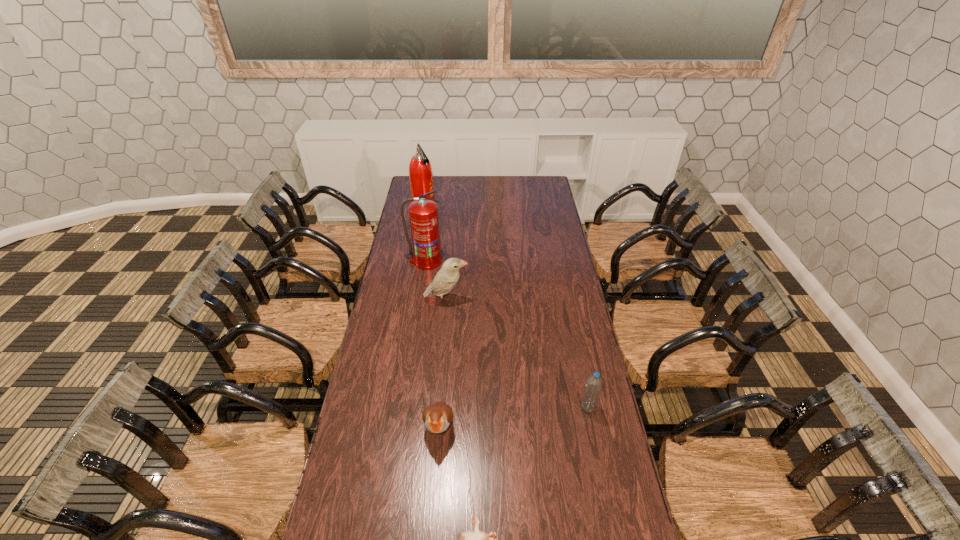
Where is `free spot located 0.050m on the front of the fourth tallest object`? The height and width of the screenshot is (540, 960). free spot located 0.050m on the front of the fourth tallest object is located at coordinates (592, 427).

At what (x,y) coordinates should I click in order to perform the action: click on vacant space located 0.090m at the face of the second farthest bird. Please return your answer as a coordinate pair (x, y). Looking at the image, I should click on (x=435, y=479).

Identify the location of object situated at the right edge. click(x=592, y=390).

At what (x,y) coordinates should I click in order to perform the action: click on vacant space at the far edge of the desktop. Please return your answer as a coordinate pair (x, y). The height and width of the screenshot is (540, 960). Looking at the image, I should click on (463, 178).

Find the location of a particular element. The width and height of the screenshot is (960, 540). blank space at the left edge is located at coordinates (350, 463).

This screenshot has width=960, height=540. I want to click on vacant area at the right edge of the desktop, so click(x=550, y=227).

What are the coordinates of `free space at the far right corner of the desktop` in the screenshot? It's located at (534, 178).

Image resolution: width=960 pixels, height=540 pixels. I want to click on free space between the second farthest object and the water bottle, so click(x=507, y=334).

What are the coordinates of `vacant area that lies between the farthest object and the rightmost object` in the screenshot? It's located at (506, 311).

You are a GUI agent. You are given a task and a screenshot of the screen. Output one action in this format:
    pyautogui.click(x=<x>, y=<y>)
    Task: Click on the empty space between the water bottle and the nearer fire extinguisher
    
    Given the screenshot: What is the action you would take?
    pyautogui.click(x=507, y=334)